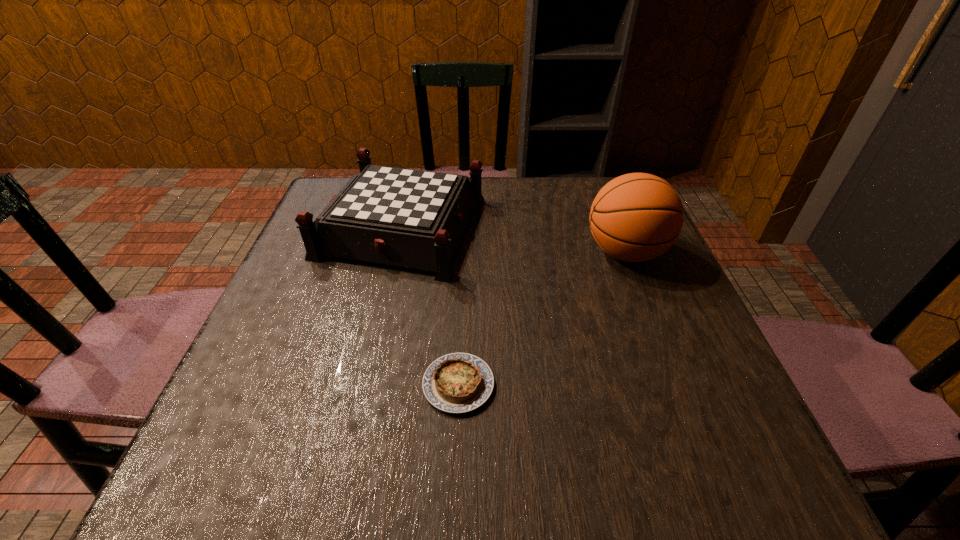
Find the location of a particular element. This screenshot has width=960, height=540. the tallest object is located at coordinates (636, 217).

You are a GUI agent. You are given a task and a screenshot of the screen. Output one action in this format:
    pyautogui.click(x=<x>, y=<y>)
    Task: Click on the rightmost object
    
    Given the screenshot: What is the action you would take?
    pyautogui.click(x=636, y=217)

Locate an element on the screen. The height and width of the screenshot is (540, 960). checkerboard is located at coordinates (409, 218).

Locate an element on the screen. The width and height of the screenshot is (960, 540). quiche is located at coordinates (458, 382).

Identify the location of the shortest object. This screenshot has height=540, width=960. (458, 382).

Identify the location of vacant space situated 0.200m on the left of the rightmost object. (497, 252).

At what (x,y) coordinates should I click in order to perform the action: click on free space located 0.130m on the right of the second tallest object. Please return your answer as a coordinate pair (x, y). Looking at the image, I should click on (538, 227).

Locate an element on the screen. free space located on the right of the shortest object is located at coordinates (670, 384).

Where is `object that is at the far edge`? object that is at the far edge is located at coordinates (409, 218).

The height and width of the screenshot is (540, 960). What are the coordinates of `object that is positioned at the left edge` in the screenshot? It's located at (409, 218).